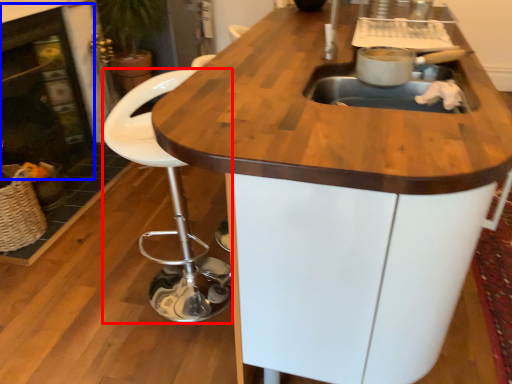
Question: Among these objects, which one is farthest to the camera, chair (highlighted by a red box) or fireplace (highlighted by a blue box)?

Choices:
 (A) chair
 (B) fireplace

Answer: (B)